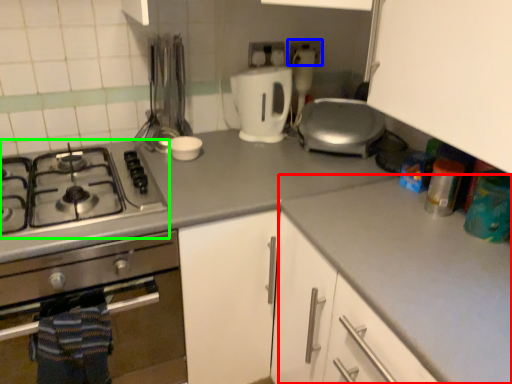
Question: Which object is positioned farthest from counter top (highlighted by a red box)? Select from electric outlet (highlighted by a blue box) and gas stove (highlighted by a green box).

Choices:
 (A) electric outlet
 (B) gas stove

Answer: (A)